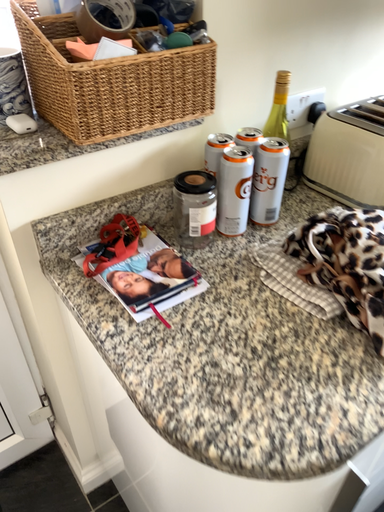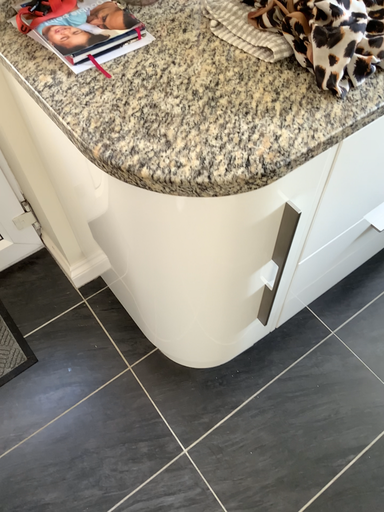
Question: Which way did the camera rotate in the video?

Choices:
 (A) rotated upward
 (B) rotated downward

Answer: (B)